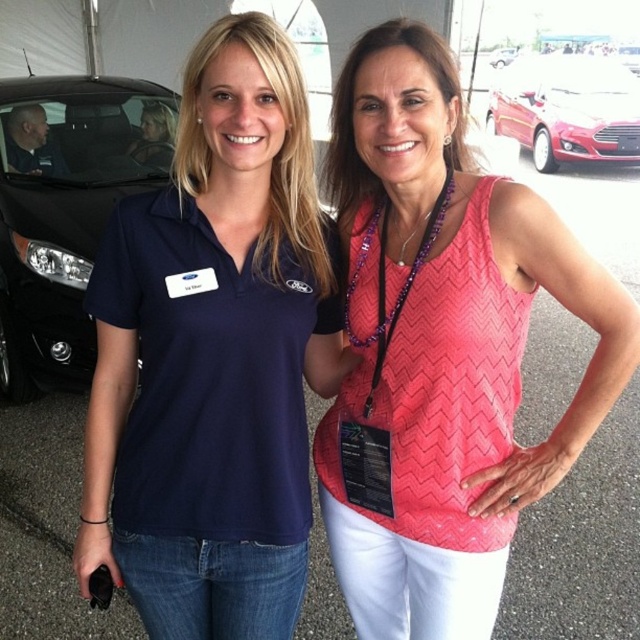
Question: Is matte blue polo shirt at center wider than pink chevron tank top at center?

Choices:
 (A) yes
 (B) no

Answer: (B)

Question: Which of these objects is positioned farthest from the purple beaded lanyard at center?

Choices:
 (A) matte black car at left
 (B) shiny red car at upper right
 (C) matte blue polo shirt at center

Answer: (B)

Question: Which point is farther to the camera?

Choices:
 (A) (445, 205)
 (B) (141, 134)
 (C) (467, 262)

Answer: (B)

Question: Which point is closer to the camera?

Choices:
 (A) matte black car at left
 (B) metallic silver car at upper center
 (C) purple beaded lanyard at center

Answer: (C)

Question: Can you confirm if shiny red car at upper right is positioned above purple beaded lanyard at center?

Choices:
 (A) no
 (B) yes

Answer: (B)

Question: Does purple beaded lanyard at center appear under metallic silver car at upper center?

Choices:
 (A) yes
 (B) no

Answer: (A)